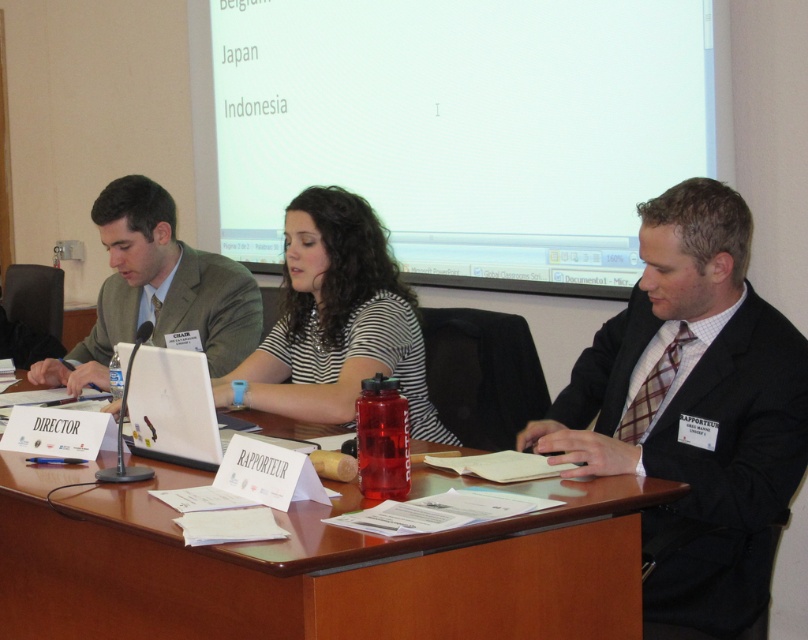
Is point (284, 273) farther from viewer compared to point (139, 243)?

No, it is not.

Which is more to the left, striped fabric shirt at center or green fabric suit at left?

From the viewer's perspective, green fabric suit at left appears more on the left side.

What do you see at coordinates (337, 321) in the screenshot? I see `striped fabric shirt at center` at bounding box center [337, 321].

Locate an element on the screen. This screenshot has height=640, width=808. striped fabric shirt at center is located at coordinates (337, 321).

From the picture: Is black suit at right below green fabric suit at left?

Correct, black suit at right is located below green fabric suit at left.

Which is below, black suit at right or green fabric suit at left?

Positioned lower is black suit at right.

In order to click on black suit at right in this screenshot , I will do `click(693, 404)`.

How distant is white matte projector screen at upper center from white plastic laptop at center?

The distance of white matte projector screen at upper center from white plastic laptop at center is 1.76 meters.

Is white matte projector screen at upper center to the right of white plastic laptop at center from the viewer's perspective?

Correct, you'll find white matte projector screen at upper center to the right of white plastic laptop at center.

Does point (545, 280) come in front of point (304, 449)?

That is False.

Where is `white matte projector screen at upper center`? The width and height of the screenshot is (808, 640). white matte projector screen at upper center is located at coordinates (465, 129).